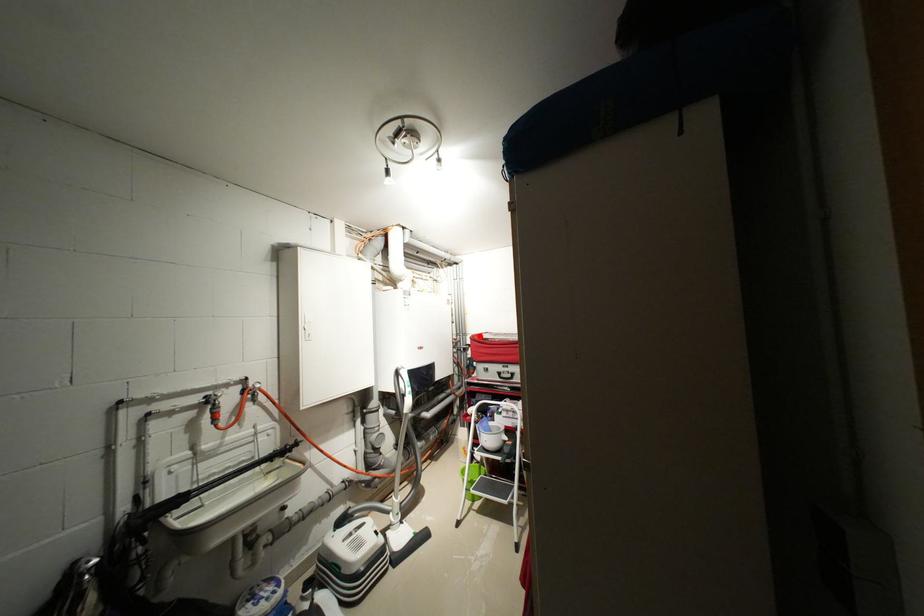
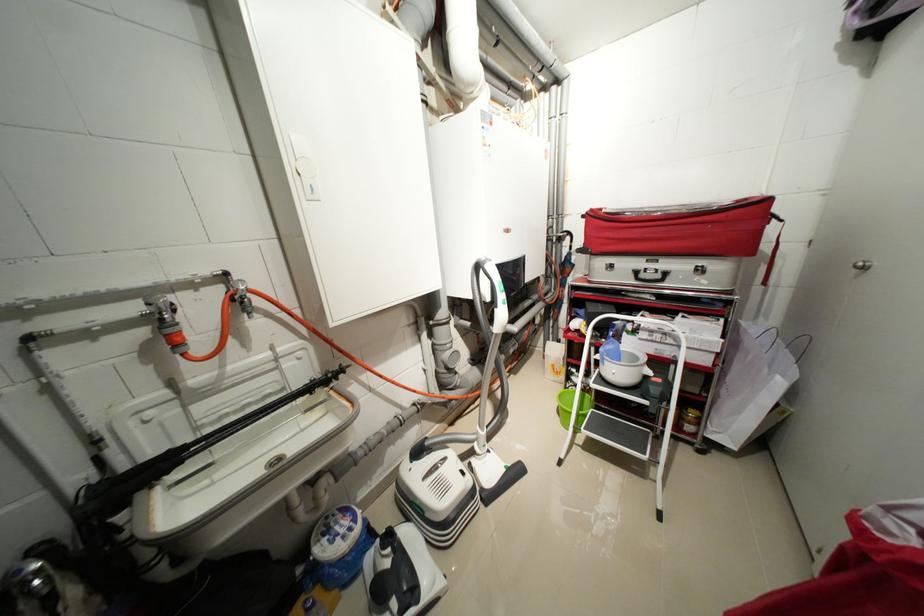
Find the pixel in the second image that matches the highlighted location in the first image.

(599, 211)